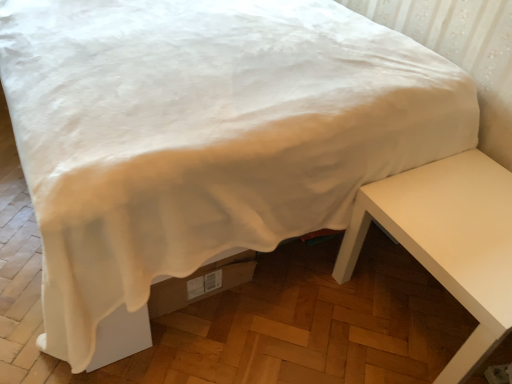
You are a GUI agent. You are given a task and a screenshot of the screen. Output one action in this format:
    pyautogui.click(x=<x>, y=<y>)
    Task: Click on the white glossy table at right
    
    Given the screenshot: What is the action you would take?
    pyautogui.click(x=448, y=241)

This screenshot has width=512, height=384. Describe the element at coordinates (448, 241) in the screenshot. I see `white glossy table at right` at that location.

Identify the location of white glossy table at right. The width and height of the screenshot is (512, 384). (448, 241).